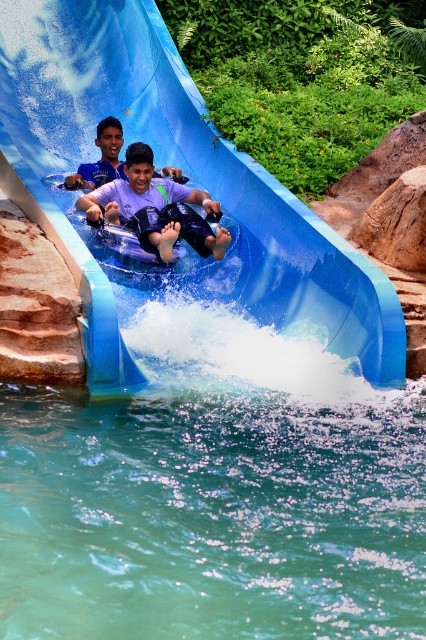
Can you confirm if blue rubber slide at center is smaller than purple matte life vest at center?

No, blue rubber slide at center is not smaller than purple matte life vest at center.

Is blue rubber slide at center above purple matte life vest at center?

Correct, blue rubber slide at center is located above purple matte life vest at center.

This screenshot has width=426, height=640. Find the location of `blue rubber slide at center`. blue rubber slide at center is located at coordinates (189, 186).

Where is `blue rubber slide at center`? The width and height of the screenshot is (426, 640). blue rubber slide at center is located at coordinates (189, 186).

Measure the distance between purple matte life vest at center and matte blue shorts at center.

They are 4.66 feet apart.

Is purple matte life vest at center taller than matte blue shorts at center?

Correct, purple matte life vest at center is much taller as matte blue shorts at center.

Describe the element at coordinates (155, 209) in the screenshot. The image size is (426, 640). I see `purple matte life vest at center` at that location.

You are a GUI agent. You are given a task and a screenshot of the screen. Output one action in this format:
    pyautogui.click(x=<x>, y=<y>)
    Task: Click on the purple matte life vest at center
    
    Given the screenshot: What is the action you would take?
    pyautogui.click(x=155, y=209)

Is blue rubber slide at center in front of matte blue shorts at center?

Yes, it is.

In the scene shown: Who is higher up, blue rubber slide at center or matte blue shorts at center?

blue rubber slide at center

Who is more forward, (43, 48) or (124, 176)?

Positioned in front is point (124, 176).

Find the location of a particular element. blue rubber slide at center is located at coordinates (x=189, y=186).